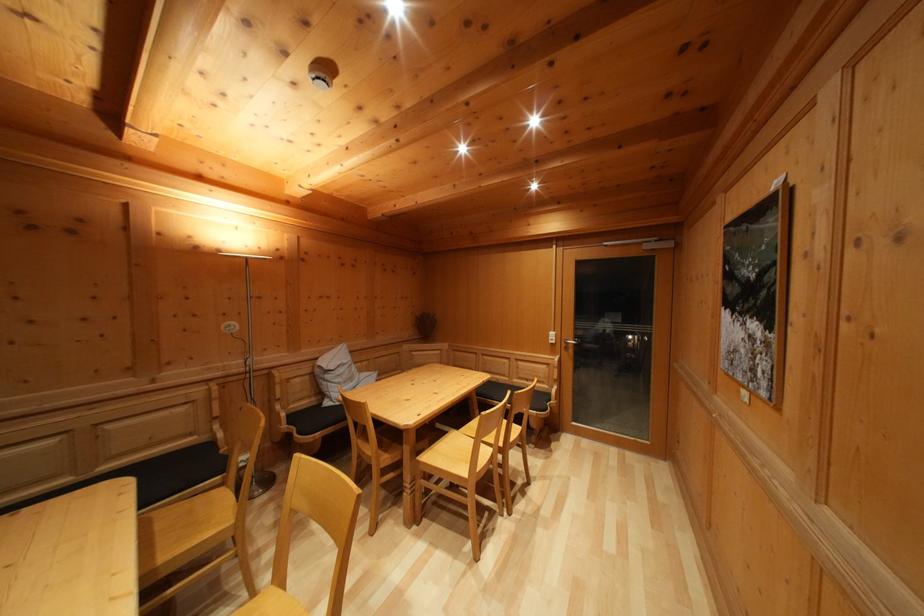
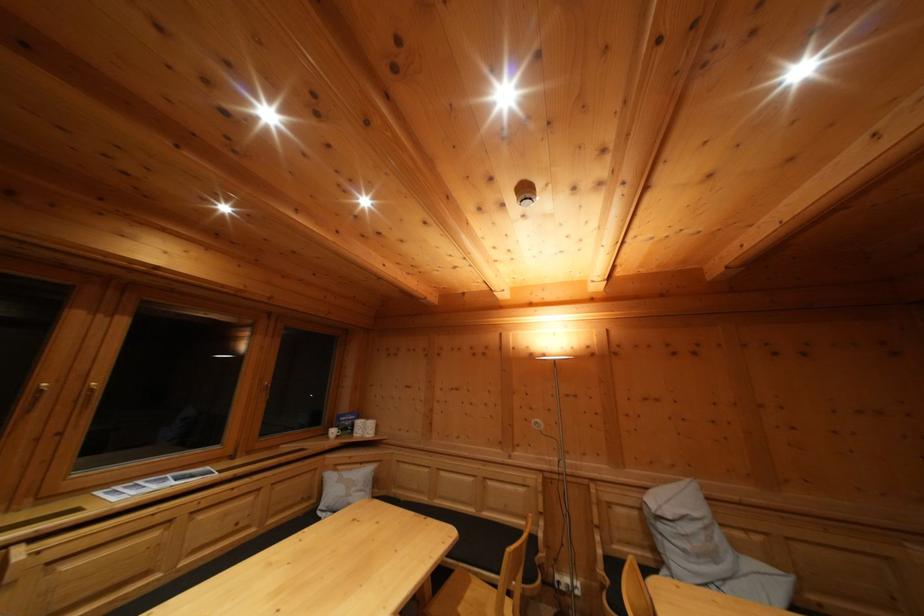
The point at (164,532) is marked in the first image. Where is the corresponding point in the second image?

(475, 601)